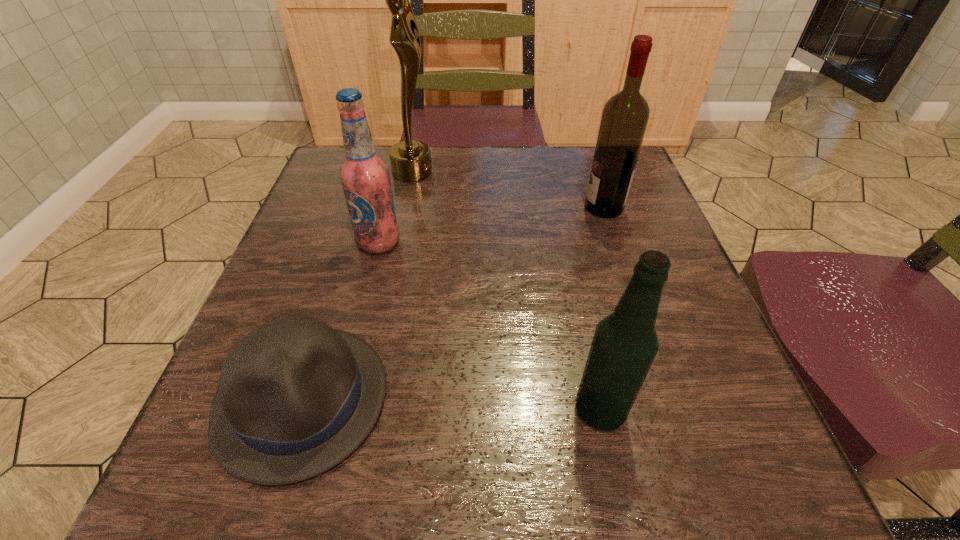
Identify the location of object that is at the near left corner. (295, 397).

Identify the location of object positioned at the far right corner. This screenshot has width=960, height=540. (625, 116).

The height and width of the screenshot is (540, 960). What are the coordinates of `vacant space at the far edge of the desktop` in the screenshot? It's located at (431, 188).

You are a GUI agent. You are given a task and a screenshot of the screen. Output one action in this format:
    pyautogui.click(x=<x>, y=<y>)
    Task: Click on the free location at the near edge
    The height and width of the screenshot is (540, 960).
    Given the screenshot: What is the action you would take?
    pyautogui.click(x=396, y=457)

In the image, there is a desktop. At what (x,y) coordinates should I click in order to perform the action: click on free space at the left edge. Please return your answer as a coordinate pair (x, y). This screenshot has width=960, height=540. Looking at the image, I should click on (328, 286).

In the image, there is a desktop. In order to click on vacant space at the right edge in this screenshot , I will do `click(682, 277)`.

In the image, there is a desktop. Identify the location of vacant space at the near right corner. This screenshot has width=960, height=540. (719, 494).

Find the location of `vacant point located between the third nearest object and the shortest object`. vacant point located between the third nearest object and the shortest object is located at coordinates (340, 321).

What are the coordinates of `free space between the shortest object and the farthest object` in the screenshot? It's located at (357, 285).

Locate an element on the screen. This screenshot has height=540, width=960. free area in between the nearest alcohol and the third nearest object is located at coordinates (490, 326).